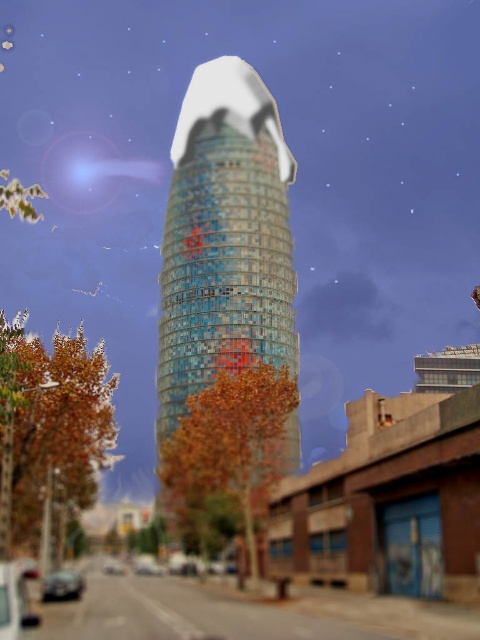
Question: Which object is closer to the camera taking this photo?

Choices:
 (A) shiny silver car at lower left
 (B) shiny silver car at center

Answer: (B)

Question: Which point appears closest to the camera in this image?

Choices:
 (A) (249, 147)
 (B) (108, 561)
 (C) (142, 557)
 (D) (72, 580)

Answer: (D)

Question: Can you confirm if multicolored glass tower at center is bigger than shiny metallic car at lower left?

Choices:
 (A) yes
 (B) no

Answer: (A)

Question: Can you confirm if multicolored glass tower at center is wider than shiny silver car at lower left?

Choices:
 (A) no
 (B) yes

Answer: (B)

Question: Estimate the real-world distances between objects in this image. Which object is farther from the shiny silver car at center?

Choices:
 (A) shiny silver car at lower left
 (B) multicolored glass tower at center

Answer: (B)

Question: In this image, where is shiny metallic car at lower left located relative to shiny silver car at lower left?

Choices:
 (A) left
 (B) right

Answer: (B)